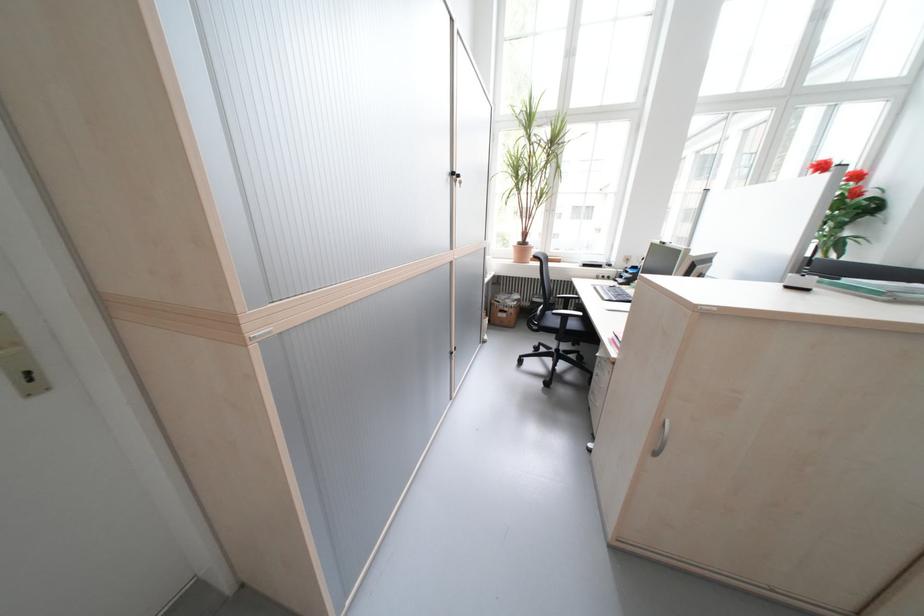
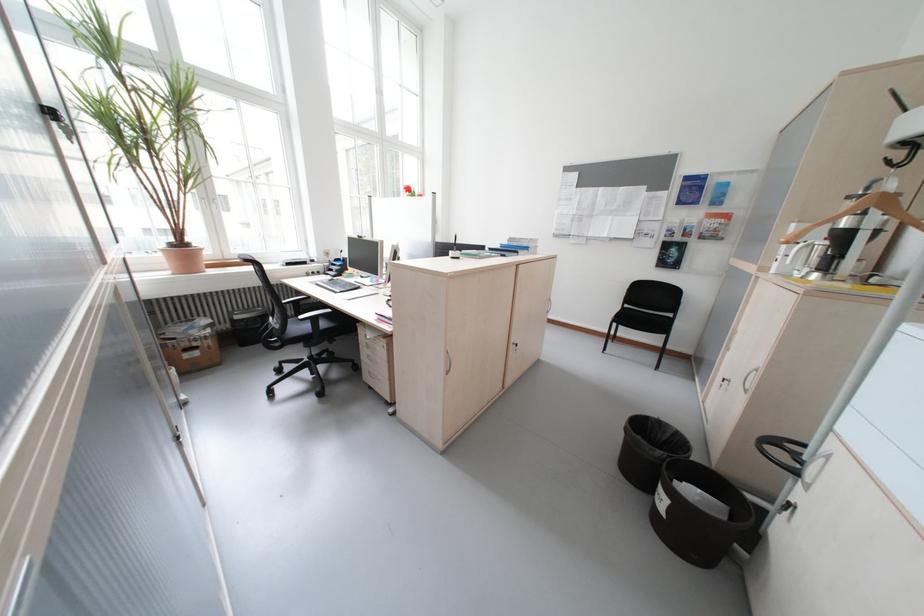
Question: Based on the continuous images, in which direction is the camera rotating? Reply with the corresponding letter.

Choices:
 (A) Left
 (B) Right
 (C) Up
 (D) Down

Answer: (B)